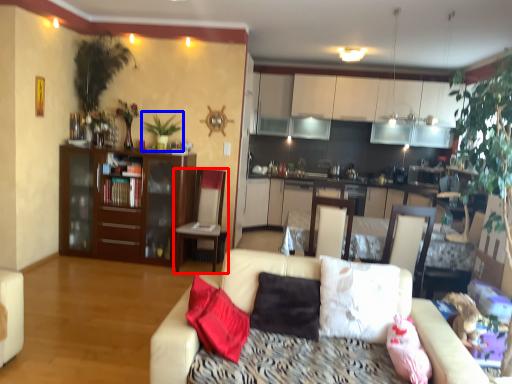
Question: Among these objects, which one is farthest to the camera, chair (highlighted by a red box) or plant (highlighted by a blue box)?

Choices:
 (A) chair
 (B) plant

Answer: (B)